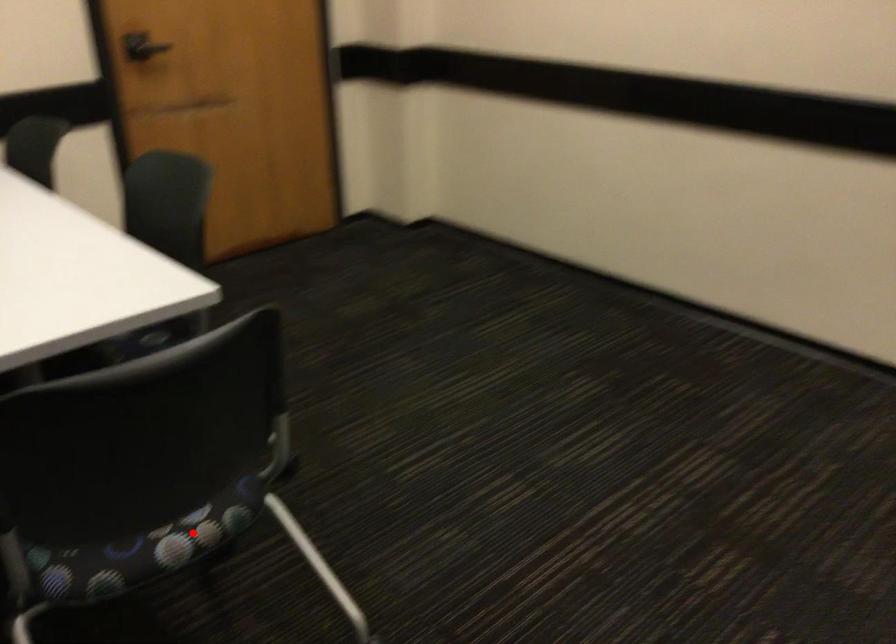
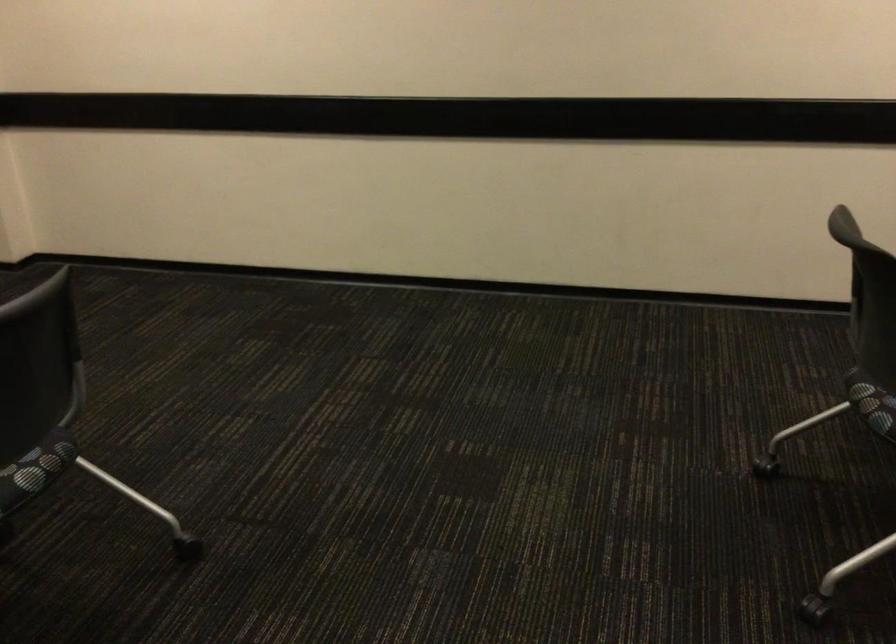
Question: A red point is marked in image1. In image2, is the corresponding 3D point closer to the camera or farther? Reply with the corresponding letter.

Choices:
 (A) The corresponding 3D point is closer.
 (B) The corresponding 3D point is farther.

Answer: (B)